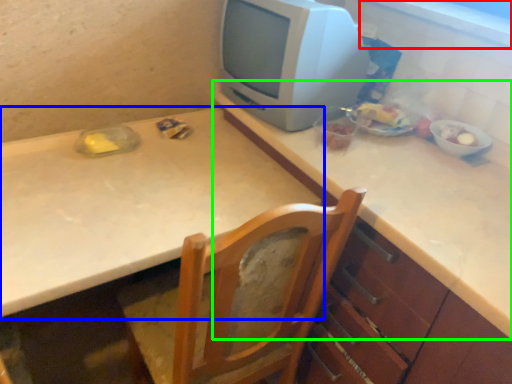
Question: Which is farther away from window sill (highlighted by a red box)? table (highlighted by a blue box) or counter top (highlighted by a green box)?

Choices:
 (A) table
 (B) counter top

Answer: (A)